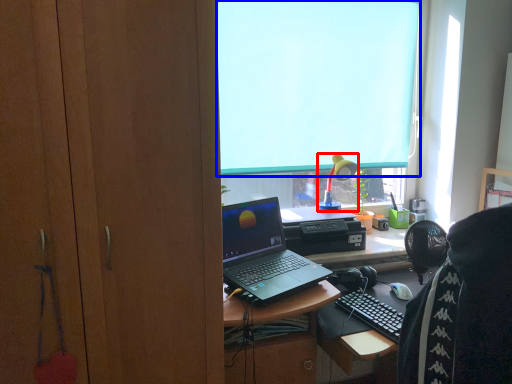
Question: Among these objects, which one is nearest to the camera, lamp (highlighted by a red box) or window screen (highlighted by a blue box)?

Choices:
 (A) lamp
 (B) window screen

Answer: (B)